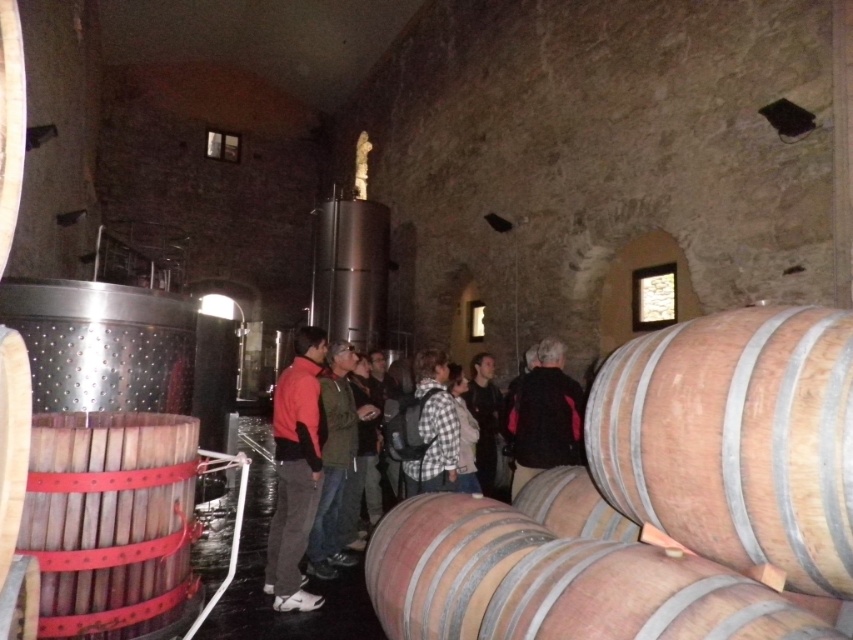
Can you confirm if natural wood barrel at right is taller than black leather jacket at center?

No.

Does natural wood barrel at right appear under black leather jacket at center?

Incorrect, natural wood barrel at right is not positioned below black leather jacket at center.

Is point (712, 376) closer to camera compared to point (527, 410)?

Yes.

Identify the location of natural wood barrel at right. (735, 438).

Can you confirm if natural wood barrel at right is wider than dark gray sweater at center?

Correct, the width of natural wood barrel at right exceeds that of dark gray sweater at center.

Can you confirm if natural wood barrel at right is bigger than dark gray sweater at center?

No, natural wood barrel at right is not bigger than dark gray sweater at center.

Find the location of a particular element. natural wood barrel at right is located at coordinates (735, 438).

Is black leather jacket at center smaller than dark gray sweater at center?

No.

This screenshot has height=640, width=853. What do you see at coordinates (544, 417) in the screenshot? I see `black leather jacket at center` at bounding box center [544, 417].

The image size is (853, 640). What do you see at coordinates (544, 417) in the screenshot?
I see `black leather jacket at center` at bounding box center [544, 417].

Locate an element on the screen. This screenshot has height=640, width=853. black leather jacket at center is located at coordinates (544, 417).